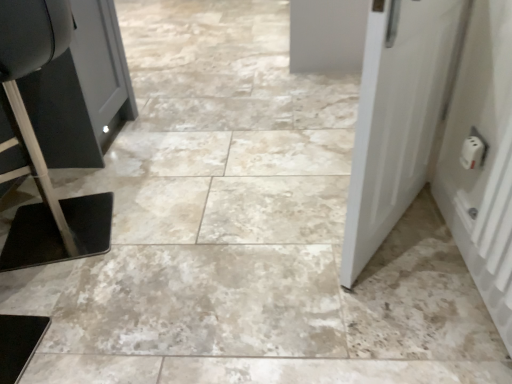
Question: From a real-world perspective, is white plastic door at right, arranged as the 2th door when viewed from the left, below white plastic outlet at right?

Choices:
 (A) yes
 (B) no

Answer: (B)

Question: Is white plastic door at right, marked as the first door in a right-to-left arrangement, positioned far away from white plastic outlet at right?

Choices:
 (A) yes
 (B) no

Answer: (B)

Question: Is the position of white plastic door at right, marked as the first door in a right-to-left arrangement, more distant than that of white plastic outlet at right?

Choices:
 (A) yes
 (B) no

Answer: (B)

Question: Is white plastic door at right, marked as the first door in a right-to-left arrangement, oriented away from white plastic outlet at right?

Choices:
 (A) no
 (B) yes

Answer: (A)

Question: Is white plastic door at right, marked as the first door in a right-to-left arrangement, wider than white plastic outlet at right?

Choices:
 (A) no
 (B) yes

Answer: (B)

Question: Is point (508, 6) closer or farther from the camera than point (472, 163)?

Choices:
 (A) farther
 (B) closer

Answer: (B)

Question: Considering the positions of white plastic door at right, arranged as the 2th door when viewed from the left, and white plastic outlet at right in the image, is white plastic door at right, arranged as the 2th door when viewed from the left, wider or thinner than white plastic outlet at right?

Choices:
 (A) wide
 (B) thin

Answer: (A)

Question: From a real-world perspective, is white plastic door at right, arranged as the 2th door when viewed from the left, above or below white plastic outlet at right?

Choices:
 (A) below
 (B) above

Answer: (B)

Question: Is white plastic door at right, marked as the first door in a right-to-left arrangement, in front of or behind white plastic outlet at right in the image?

Choices:
 (A) behind
 (B) front

Answer: (B)

Question: Is white matte door at right, positioned as the 2th door in right-to-left order, inside the boundaries of white plastic outlet at right, or outside?

Choices:
 (A) outside
 (B) inside

Answer: (A)

Question: From the image's perspective, relative to white plastic outlet at right, is white matte door at right, the first door in the left-to-right sequence, above or below?

Choices:
 (A) below
 (B) above

Answer: (B)

Question: From a real-world perspective, is white matte door at right, positioned as the 2th door in right-to-left order, positioned above or below white plastic outlet at right?

Choices:
 (A) below
 (B) above

Answer: (B)

Question: Is white matte door at right, the first door in the left-to-right sequence, wider or thinner than white plastic outlet at right?

Choices:
 (A) thin
 (B) wide

Answer: (B)

Question: Considering the positions of point (500, 284) and point (445, 43), is point (500, 284) closer or farther from the camera than point (445, 43)?

Choices:
 (A) closer
 (B) farther

Answer: (A)

Question: Visually, is white plastic door at right, marked as the first door in a right-to-left arrangement, positioned to the left or to the right of white matte door at right, positioned as the 2th door in right-to-left order?

Choices:
 (A) right
 (B) left

Answer: (A)